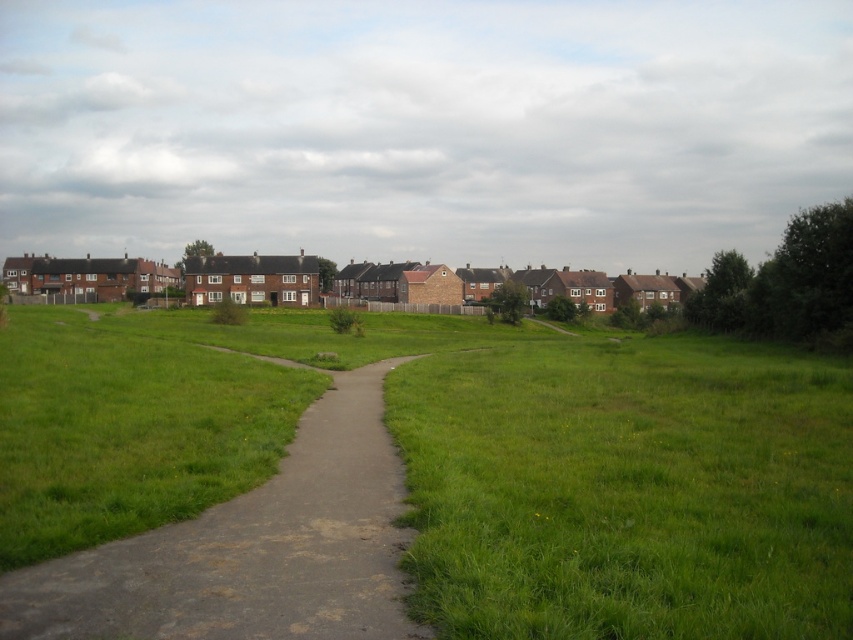
Question: Which object appears closest to the camera in this image?

Choices:
 (A) green grass at center
 (B) dull gray concrete path at center

Answer: (A)

Question: Is green grass at center positioned before dull gray concrete path at center?

Choices:
 (A) yes
 (B) no

Answer: (A)

Question: Is green grass at center below dull gray concrete path at center?

Choices:
 (A) yes
 (B) no

Answer: (B)

Question: Does green grass at center appear on the right side of dull gray concrete path at center?

Choices:
 (A) yes
 (B) no

Answer: (A)